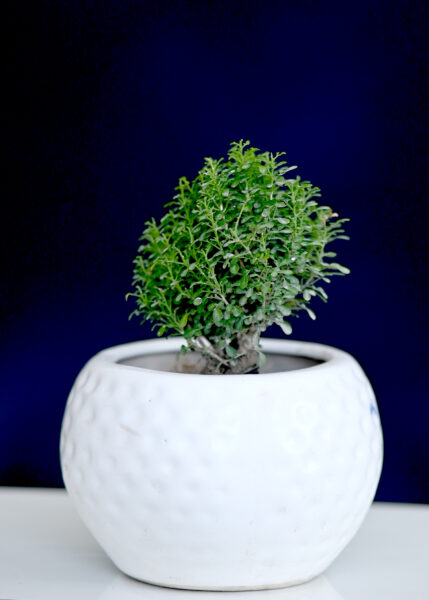
You are a GUI agent. You are given a task and a screenshot of the screen. Output one action in this format:
    pyautogui.click(x=<x>, y=<y>)
    Task: Click on the wall
    Image resolution: width=429 pixels, height=600 pixels.
    Given the screenshot: What is the action you would take?
    pyautogui.click(x=44, y=298)